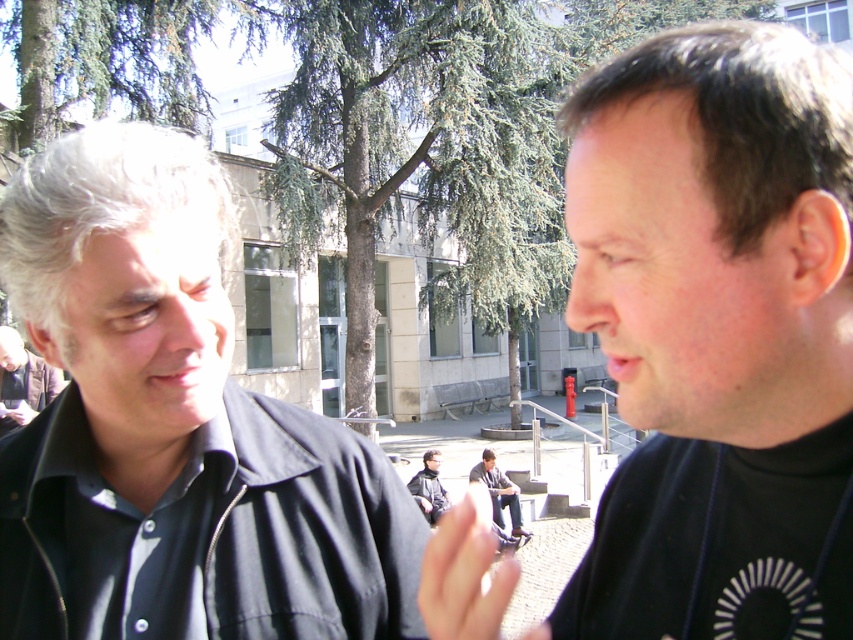
You are standing in the park and want to take a photo of the black matte shirt at left and the dark gray jeans at center. Which one should you focus on first to ensure both are in focus?

The black matte shirt at left is closer to the viewer than the dark gray jeans at center, so you should focus on the black matte shirt at left first to ensure both are in focus.

You are a photographer trying to capture a portrait of the black matte shirt at left. Where should you position your camera to ensure the subject is centered in the frame?

To center the black matte shirt at left in the frame, position the camera at point 0.670 on the x axis and 0.204 on the y axis.